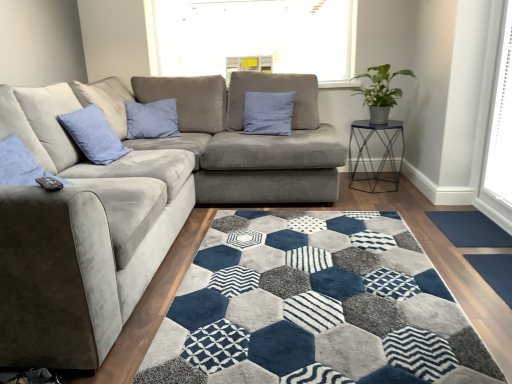
Question: Considering the relative sizes of green matte plant at upper right and metallic hexagonal table at right in the image provided, is green matte plant at upper right bigger than metallic hexagonal table at right?

Choices:
 (A) no
 (B) yes

Answer: (A)

Question: Is green matte plant at upper right completely or partially outside of metallic hexagonal table at right?

Choices:
 (A) yes
 (B) no

Answer: (A)

Question: Are green matte plant at upper right and metallic hexagonal table at right far apart?

Choices:
 (A) no
 (B) yes

Answer: (A)

Question: Is green matte plant at upper right to the left of metallic hexagonal table at right from the viewer's perspective?

Choices:
 (A) yes
 (B) no

Answer: (A)

Question: From the image's perspective, does green matte plant at upper right appear lower than metallic hexagonal table at right?

Choices:
 (A) yes
 (B) no

Answer: (B)

Question: Is point (350, 134) closer or farther from the camera than point (509, 283)?

Choices:
 (A) farther
 (B) closer

Answer: (A)

Question: From a real-world perspective, relative to dark gray rubber doormat at lower right, which is counted as the 1th doormat, starting from the bottom, is metallic hexagonal table at right vertically above or below?

Choices:
 (A) above
 (B) below

Answer: (A)

Question: Is metallic hexagonal table at right in front of or behind dark gray rubber doormat at lower right, positioned as the second doormat in top-to-bottom order, in the image?

Choices:
 (A) front
 (B) behind

Answer: (B)

Question: Based on their positions, is metallic hexagonal table at right located to the left or right of dark gray rubber doormat at lower right, positioned as the second doormat in top-to-bottom order?

Choices:
 (A) right
 (B) left

Answer: (B)

Question: In terms of width, does white plastic blinds at right look wider or thinner when compared to velvet gray couch at center?

Choices:
 (A) wide
 (B) thin

Answer: (B)

Question: From the image's perspective, is white plastic blinds at right above or below velvet gray couch at center?

Choices:
 (A) above
 (B) below

Answer: (A)

Question: Is white plastic blinds at right inside or outside of velvet gray couch at center?

Choices:
 (A) inside
 (B) outside

Answer: (B)

Question: In the image, is white plastic blinds at right positioned in front of or behind velvet gray couch at center?

Choices:
 (A) behind
 (B) front

Answer: (A)

Question: Considering the positions of point (373, 92) and point (501, 264), is point (373, 92) closer or farther from the camera than point (501, 264)?

Choices:
 (A) farther
 (B) closer

Answer: (A)

Question: Is green matte plant at upper right in front of or behind dark gray rubber doormat at lower right, the 1th doormat viewed from the front, in the image?

Choices:
 (A) front
 (B) behind

Answer: (B)